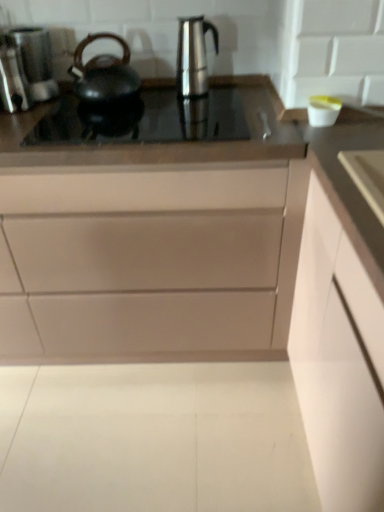
I want to click on vacant space in front of black matte kettle at left, so click(83, 118).